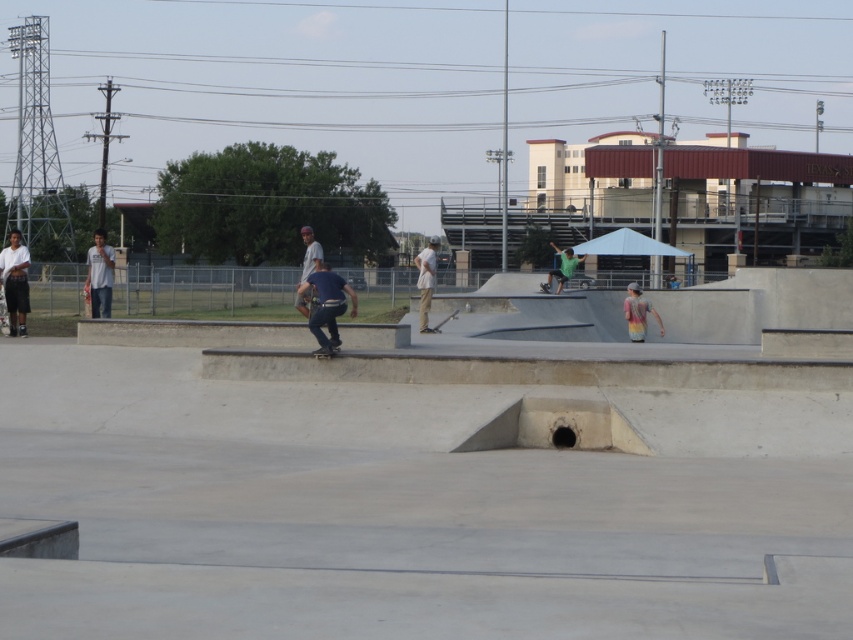
Is point (628, 332) farther from camera compared to point (332, 349)?

Yes, point (628, 332) is farther from viewer.

Between rainbow tie-dye shirt at center and black matte skateboard at center, which one is positioned higher?

rainbow tie-dye shirt at center

Which is in front, point (640, 326) or point (315, 355)?

Positioned in front is point (315, 355).

Image resolution: width=853 pixels, height=640 pixels. In order to click on rainbow tie-dye shirt at center in this screenshot , I will do `click(637, 314)`.

Does light brown canvas pants at center appear on the left side of black matte skateboard at center?

No, light brown canvas pants at center is not to the left of black matte skateboard at center.

Does point (421, 316) come closer to viewer compared to point (334, 352)?

No, (421, 316) is behind (334, 352).

Locate an element on the screen. This screenshot has width=853, height=640. light brown canvas pants at center is located at coordinates (426, 282).

Who is shorter, dark blue jeans at center or rainbow tie-dye shirt at center?

rainbow tie-dye shirt at center is shorter.

What do you see at coordinates (328, 307) in the screenshot? I see `dark blue jeans at center` at bounding box center [328, 307].

The image size is (853, 640). In order to click on dark blue jeans at center in this screenshot , I will do `click(328, 307)`.